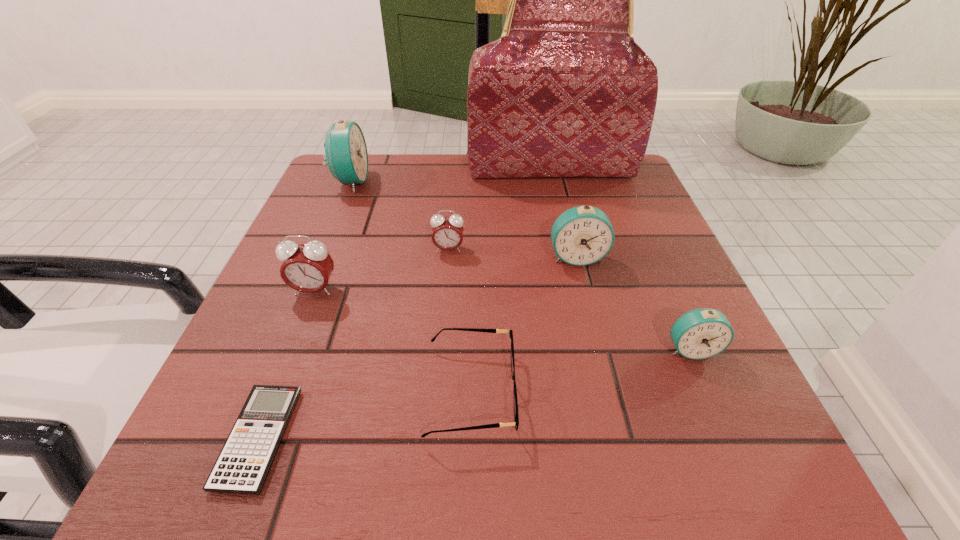
Where is `the nearest alarm clock`? Image resolution: width=960 pixels, height=540 pixels. the nearest alarm clock is located at coordinates (702, 333).

Where is `spectacles`? The height and width of the screenshot is (540, 960). spectacles is located at coordinates (516, 417).

At what (x,y) coordinates should I click in order to perform the action: click on the shortest object. Please return your answer as a coordinate pair (x, y). Looking at the image, I should click on (244, 462).

Where is `vacant space situated 0.370m on the front-facing side of the tallest object`? This screenshot has width=960, height=540. vacant space situated 0.370m on the front-facing side of the tallest object is located at coordinates (579, 287).

Where is `vacant space located on the front-facing side of the second tallest object`? vacant space located on the front-facing side of the second tallest object is located at coordinates click(x=435, y=181).

This screenshot has width=960, height=540. What are the coordinates of `vacant region located 0.150m on the clock face of the nearer pink alarm clock` in the screenshot? It's located at (283, 370).

Find the location of `free region located 0.250m on the front-facing side of the second nearest blue alarm clock`. free region located 0.250m on the front-facing side of the second nearest blue alarm clock is located at coordinates (608, 383).

The image size is (960, 540). I want to click on vacant area situated 0.310m on the clock face of the farther pink alarm clock, so click(x=437, y=393).

Image resolution: width=960 pixels, height=540 pixels. Identify the location of vacant space located on the front-facing side of the rightmost blue alarm clock. (714, 403).

I want to click on blank area located 0.180m on the front-facing side of the second shortest object, so click(639, 392).